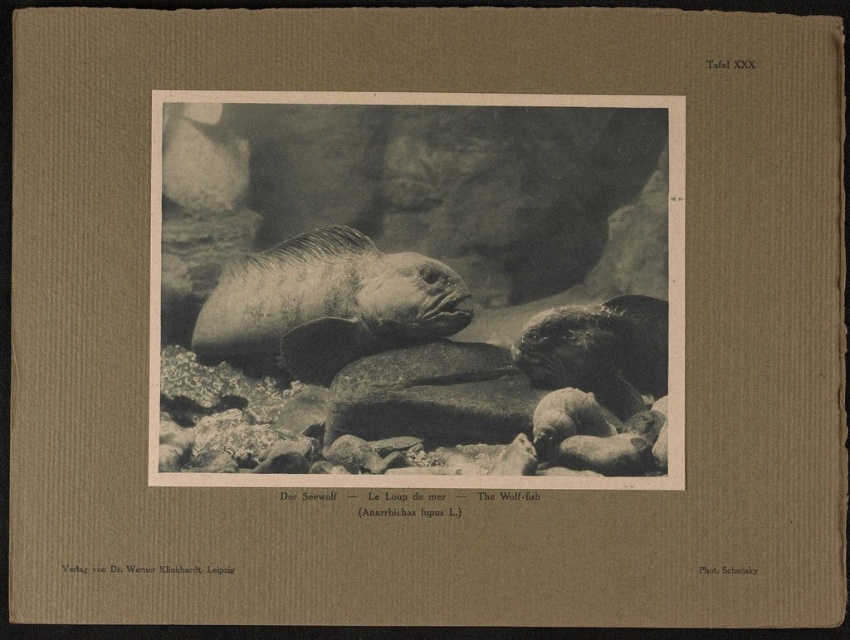
You are an underwater photographer aiming to capture a closeup of the wolf fish. You need to adjust your camera to focus on either the point at [326,372] or the point at [552,310]. Which point should you focus on to ensure the fish is in sharp focus?

You should focus on point [326,372] because it is closer to the viewer than point [552,310], ensuring the wolf fish is in sharp focus.

You are an aquarium designer planning to place both the gray textured fish at center and the shiny dark gray wolf fish at center in a tank. Given their sizes, which fish requires a wider tank to accommodate its body width?

The gray textured fish at center requires a wider tank because its width is larger than the shiny dark gray wolf fish at center.